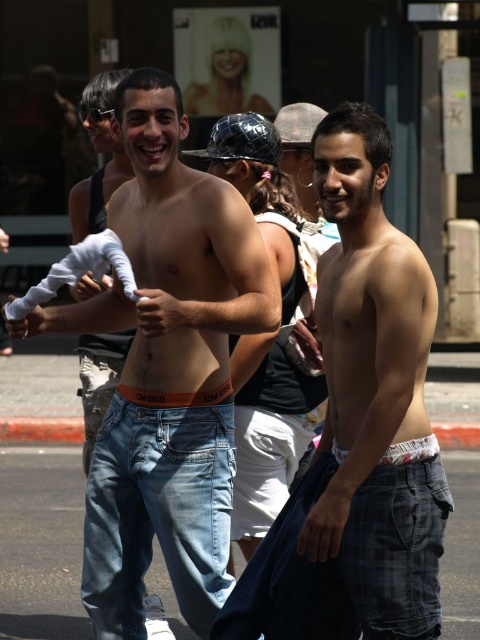
Question: Based on their relative distances, which object is farther from the white cotton underwear at lower right?

Choices:
 (A) orange fabric underwear at center
 (B) white cotton shorts at center
 (C) jeans at center

Answer: (C)

Question: Considering the real-world distances, which object is farthest from the jeans at center?

Choices:
 (A) orange fabric underwear at center
 (B) light blue denim jeans at center
 (C) white cotton underwear at lower right

Answer: (C)

Question: Which point is closer to the camera?

Choices:
 (A) light blue denim jeans at center
 (B) white cotton underwear at lower right
 (C) jeans at center

Answer: (B)

Question: Does light blue denim jeans at center appear under jeans at center?

Choices:
 (A) yes
 (B) no

Answer: (A)

Question: Can you confirm if white cotton shorts at center is thinner than white cotton underwear at lower right?

Choices:
 (A) yes
 (B) no

Answer: (B)

Question: Can you confirm if white cotton shorts at center is wider than light blue denim jeans at center?

Choices:
 (A) no
 (B) yes

Answer: (A)